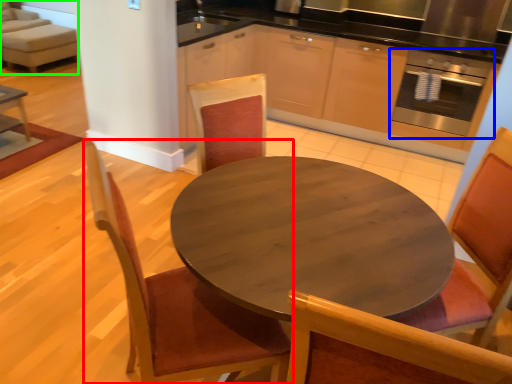
Question: Which is farther away from chair (highlighted by a red box)? oven (highlighted by a blue box) or couch (highlighted by a green box)?

Choices:
 (A) oven
 (B) couch

Answer: (B)